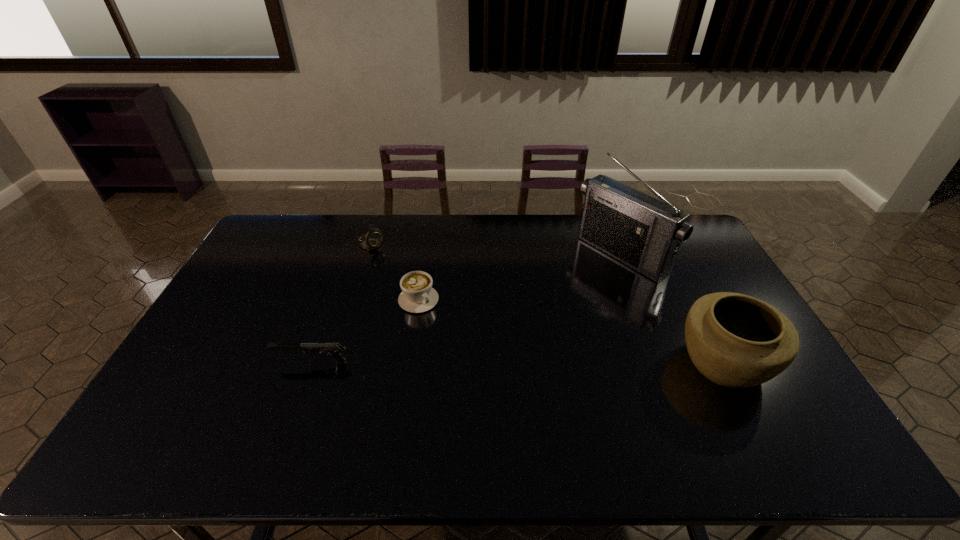
The width and height of the screenshot is (960, 540). In order to click on free space on the desktop that is between the gun and the second tallest object and is positioned on the face of the third shortest object in this screenshot , I will do `click(519, 362)`.

This screenshot has height=540, width=960. In order to click on free spot on the desktop that is between the gun and the second tallest object and is positioned to the right of the cappuccino's handle in this screenshot , I will do `click(474, 362)`.

The image size is (960, 540). Find the location of `free space on the desktop that is between the gun and the second tallest object and is positioned on the front-facing side of the tallest object`. free space on the desktop that is between the gun and the second tallest object and is positioned on the front-facing side of the tallest object is located at coordinates pyautogui.click(x=465, y=362).